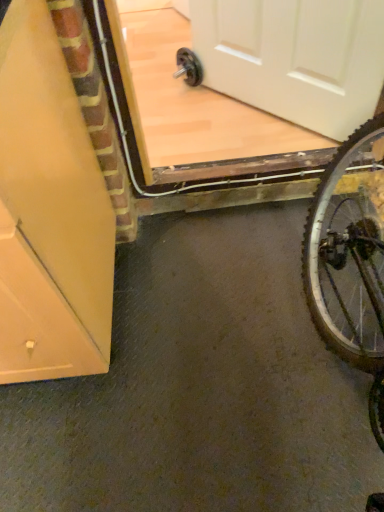
The image size is (384, 512). I want to click on matte yellow door at left, so click(x=49, y=213).

What do you see at coordinates (49, 213) in the screenshot? I see `matte yellow door at left` at bounding box center [49, 213].

Locate an element on the screen. The height and width of the screenshot is (512, 384). matte yellow door at left is located at coordinates (49, 213).